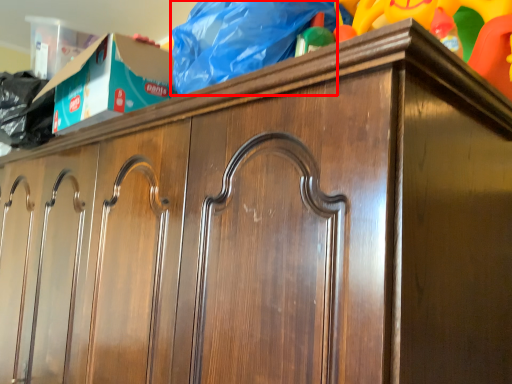
Question: In this image, where is material (annotated by the red box) located relative to toy?

Choices:
 (A) left
 (B) right

Answer: (A)